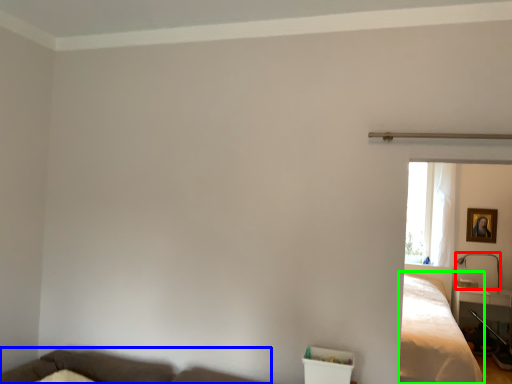
Question: Which is nearer to the lamp (highlighted by a red box)? couch (highlighted by a blue box) or bed (highlighted by a green box).

Choices:
 (A) couch
 (B) bed

Answer: (B)